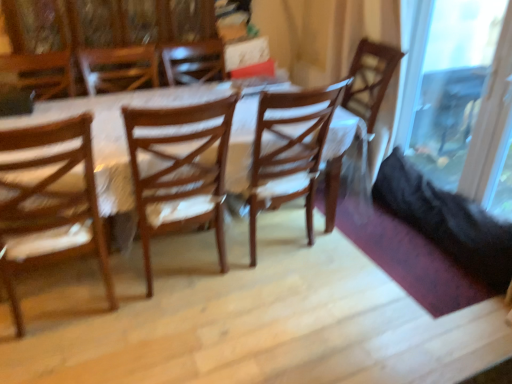
Question: Does transparent glass door at right turn towards wooden chair at center, the second chair viewed from the left?

Choices:
 (A) yes
 (B) no

Answer: (A)

Question: Is transparent glass door at right further to the viewer compared to wooden chair at center, the second chair in the right-to-left sequence?

Choices:
 (A) yes
 (B) no

Answer: (A)

Question: From a real-world perspective, is transparent glass door at right on wooden chair at center, the second chair viewed from the left?

Choices:
 (A) no
 (B) yes

Answer: (B)

Question: From a real-world perspective, is transparent glass door at right under wooden chair at center, the second chair viewed from the left?

Choices:
 (A) no
 (B) yes

Answer: (A)

Question: From the image's perspective, is transparent glass door at right below wooden chair at center, the second chair viewed from the left?

Choices:
 (A) no
 (B) yes

Answer: (A)

Question: Is transparent glass door at right located outside wooden chair at center, the second chair viewed from the left?

Choices:
 (A) yes
 (B) no

Answer: (A)

Question: Can you confirm if transparent glass door at right is wider than wooden chair at left, acting as the third chair starting from the right?

Choices:
 (A) no
 (B) yes

Answer: (A)

Question: Is transparent glass door at right smaller than wooden chair at left, the first chair in the left-to-right sequence?

Choices:
 (A) yes
 (B) no

Answer: (A)

Question: Is transparent glass door at right behind wooden chair at left, the first chair in the left-to-right sequence?

Choices:
 (A) no
 (B) yes

Answer: (B)

Question: From the image's perspective, would you say transparent glass door at right is positioned over wooden chair at left, acting as the third chair starting from the right?

Choices:
 (A) no
 (B) yes

Answer: (B)

Question: Is transparent glass door at right thinner than wooden chair at left, acting as the third chair starting from the right?

Choices:
 (A) no
 (B) yes

Answer: (B)

Question: From the image's perspective, does transparent glass door at right appear lower than wooden chair at left, the first chair in the left-to-right sequence?

Choices:
 (A) no
 (B) yes

Answer: (A)

Question: From the image's perspective, does wooden chair at left, the first chair in the left-to-right sequence, appear lower than wooden chair at center, which is counted as the first chair, starting from the right?

Choices:
 (A) no
 (B) yes

Answer: (B)